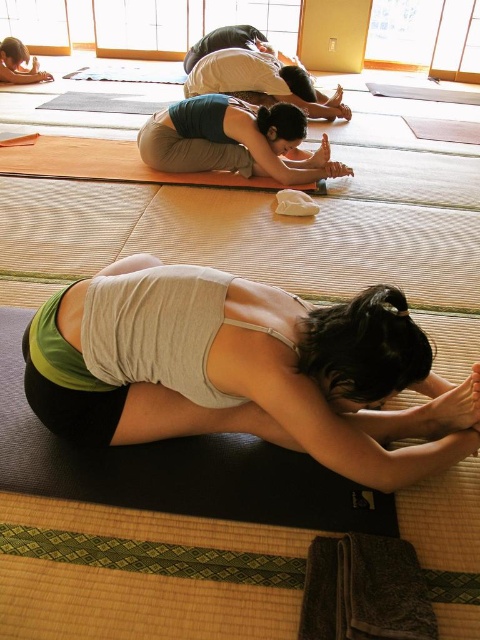
Is point (327, 348) more distant than point (297, 145)?

No.

Which is behind, point (398, 480) or point (139, 141)?

Point (139, 141)

Between point (104, 440) and point (303, 120), which one is positioned in front?

Positioned in front is point (104, 440).

The height and width of the screenshot is (640, 480). Find the location of `white matte tank top at center`. white matte tank top at center is located at coordinates (300, 388).